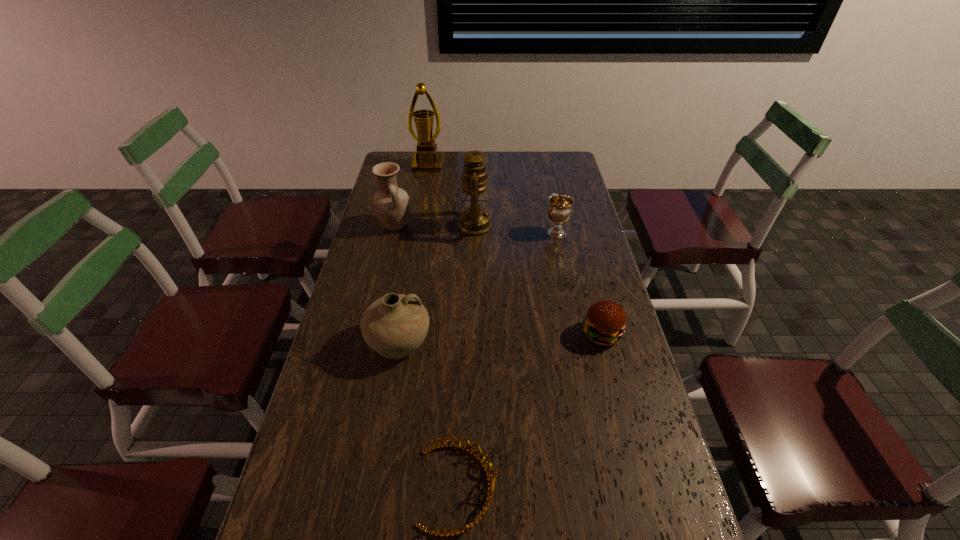
Identify the location of blank area located on the left of the oil lamp. The image size is (960, 540). (381, 226).

Where is `vacant space located on the back of the third tallest object`? The height and width of the screenshot is (540, 960). vacant space located on the back of the third tallest object is located at coordinates (408, 171).

Where is `free space located on the right of the fourth tallest object`? free space located on the right of the fourth tallest object is located at coordinates tap(568, 343).

This screenshot has height=540, width=960. Find the location of `free space located on the back of the chalice`. free space located on the back of the chalice is located at coordinates (551, 205).

Where is `free space located on the back of the hamburger`? Image resolution: width=960 pixels, height=540 pixels. free space located on the back of the hamburger is located at coordinates (580, 250).

You are a GUI agent. You are given a task and a screenshot of the screen. Output one action in this format:
    pyautogui.click(x=<x>, y=<y>)
    Task: Click on the object present at the far edge
    The height and width of the screenshot is (540, 960).
    Given the screenshot: What is the action you would take?
    pyautogui.click(x=426, y=159)

Identify the location of award situated at the left edge. The width and height of the screenshot is (960, 540). (426, 159).

Where is `chalice at the right edge`? chalice at the right edge is located at coordinates point(560,209).

Where is `hamburger that is at the right edge`? This screenshot has width=960, height=540. hamburger that is at the right edge is located at coordinates (605, 321).

Find the location of a particular element. The width and height of the screenshot is (960, 540). object located in the far left corner section of the desktop is located at coordinates (426, 159).